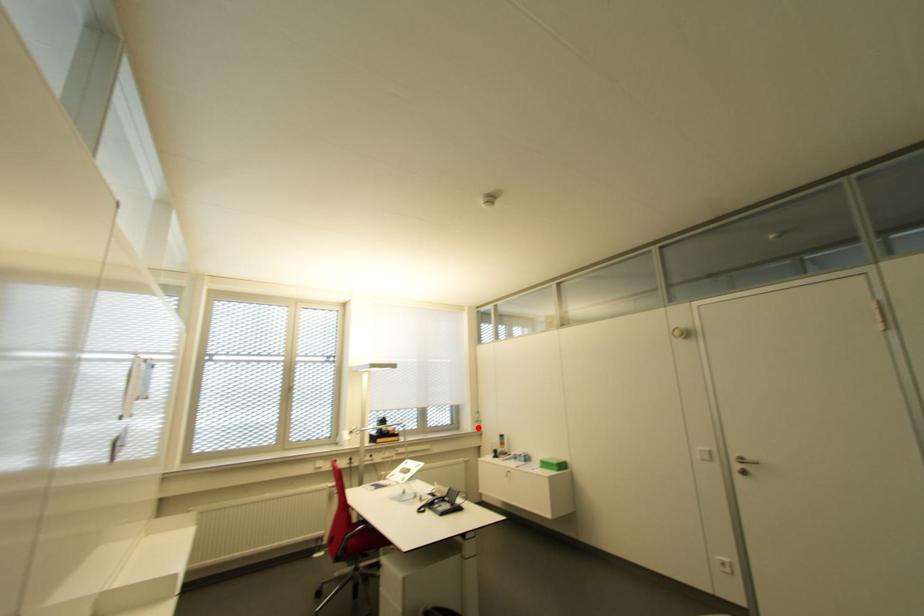
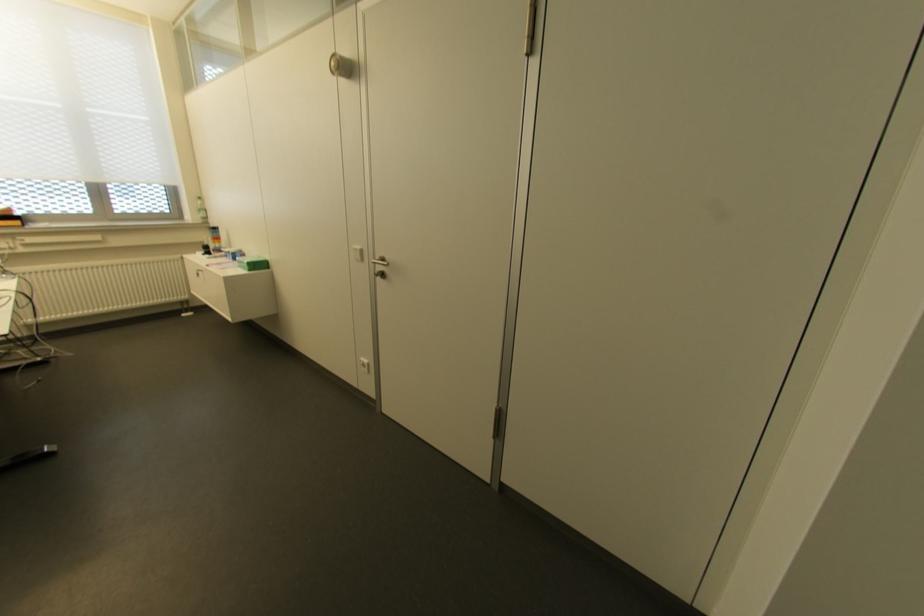
Where in the second image is the point corresponding to the highlighted location from the first image?

(204, 217)